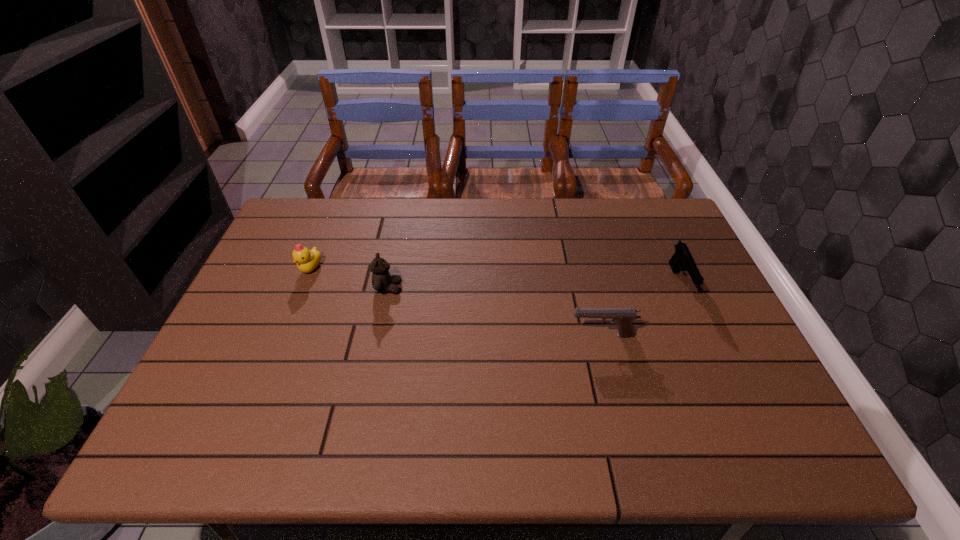
Find the location of `free spot between the teddy bear and the leftmost object`. free spot between the teddy bear and the leftmost object is located at coordinates (349, 278).

Locate an element on the screen. This screenshot has width=960, height=540. empty space that is in between the second object from left to right and the leftmost object is located at coordinates (349, 278).

This screenshot has width=960, height=540. What are the coordinates of `vacant space that's between the nearer pistol and the farther pistol` in the screenshot? It's located at (641, 308).

At what (x,y) coordinates should I click in order to perform the action: click on free space between the third object from left to right and the teddy bear. Please return your answer as a coordinate pair (x, y). Image resolution: width=960 pixels, height=540 pixels. Looking at the image, I should click on (495, 312).

What are the coordinates of `unoccupied area between the leftmost object and the right pistol` in the screenshot? It's located at (495, 275).

Identify the location of vacant space that is in between the second object from left to right and the rightmost object. The image size is (960, 540). (534, 285).

What are the coordinates of `free point between the farther pistol and the leftmost object` in the screenshot? It's located at (495, 275).

The width and height of the screenshot is (960, 540). I want to click on free space between the third object from left to right and the farther pistol, so click(641, 308).

Locate an element on the screen. free space that is in between the right pistol and the third object from left to right is located at coordinates (641, 308).

Locate an element on the screen. This screenshot has width=960, height=540. object that stands as the third closest to the leftmost object is located at coordinates (682, 259).